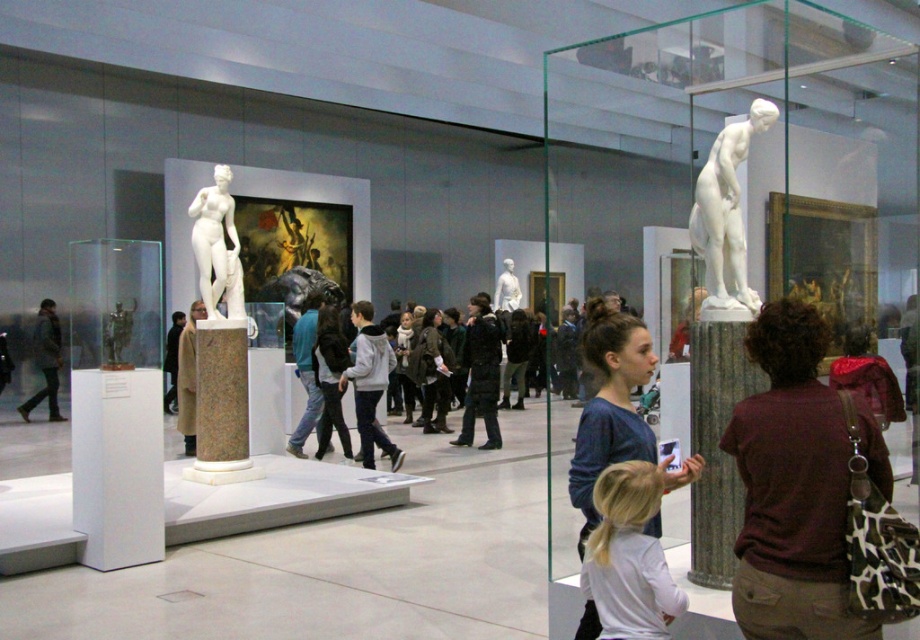
Question: Which object is positioned closest to the blue cotton shirt at center?

Choices:
 (A) dark gray jacket at left
 (B) white marble statue at center
 (C) white marble statue at upper right
 (D) maroon fabric shirt at right

Answer: (D)

Question: Which point is farther to the camera?

Choices:
 (A) (628, 428)
 (B) (504, 264)

Answer: (B)

Question: Does white marble statue at upper right appear over white marble statue at left?

Choices:
 (A) no
 (B) yes

Answer: (B)

Question: Considering the relative positions of white marble statue at upper right and white marble statue at center in the image provided, where is white marble statue at upper right located with respect to white marble statue at center?

Choices:
 (A) above
 (B) below

Answer: (A)

Question: Estimate the real-world distances between objects in this image. Which object is closer to the white marble statue at center?

Choices:
 (A) maroon fabric shirt at right
 (B) blue cotton shirt at center
 (C) green marble pillar at lower right
 (D) white marble statue at left

Answer: (D)

Question: Does green marble pillar at lower right have a greater width compared to white marble statue at upper right?

Choices:
 (A) no
 (B) yes

Answer: (A)